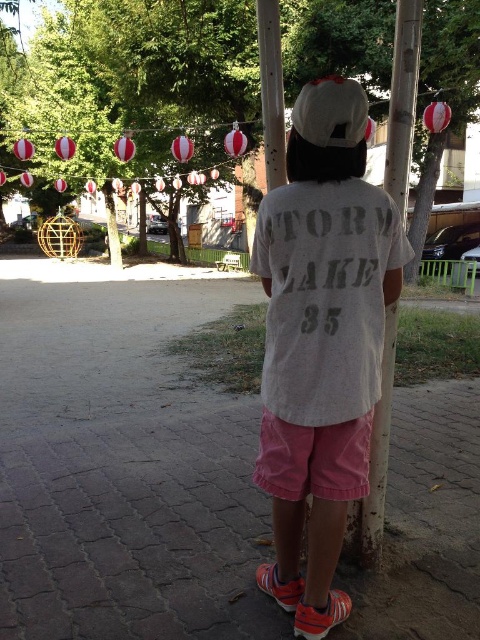
You are a photographer trying to capture the white cotton shirt at center and the rusty metal pole at center in the same frame. Based on their positions, which object should you adjust your camera to focus on first to ensure both are in the frame?

The white cotton shirt at center is to the left of the rusty metal pole at center, so you should focus on the rusty metal pole at center first to ensure both objects are captured in the frame.

You are a photographer trying to capture the white cotton shirt at center in the image. Where should you focus your camera to ensure the shirt is in the frame?

You should focus your camera at point [322,340] to capture the white cotton shirt at center.